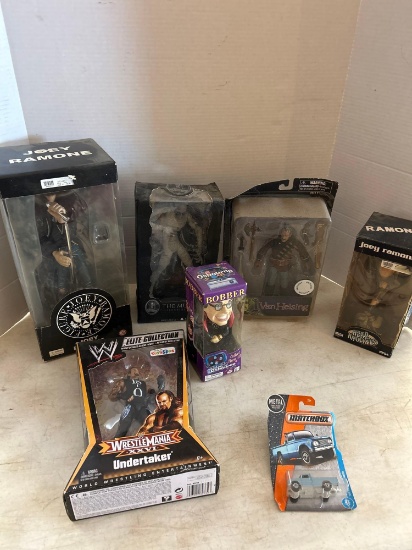
Find the location of a particular element. action figure is located at coordinates (141, 383), (220, 321), (379, 282), (283, 242), (174, 243), (72, 229).